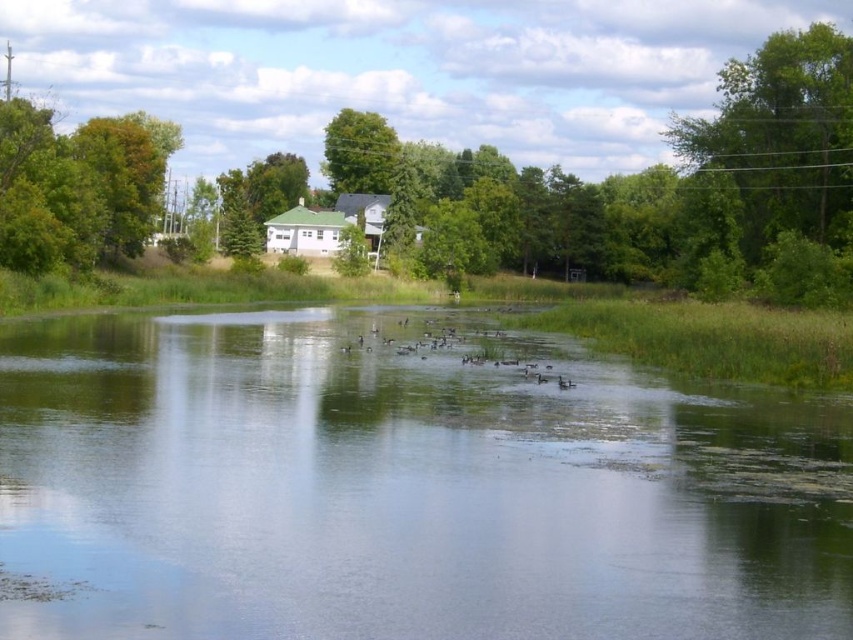
Question: Can you confirm if brown matte duck at center is positioned to the left of green leafy tree at center?

Choices:
 (A) no
 (B) yes

Answer: (A)

Question: Which point is closer to the camera?

Choices:
 (A) green leafy tree at center
 (B) green grassy water at center
 (C) brown matte duck at center
 (D) green leafy tree at upper left

Answer: (B)

Question: Does green grassy water at center have a greater width compared to green leafy tree at upper left?

Choices:
 (A) no
 (B) yes

Answer: (B)

Question: Estimate the real-world distances between objects in this image. Which object is farther from the green grassy water at center?

Choices:
 (A) green leafy tree at center
 (B) brown matte duck at center

Answer: (A)

Question: Among these points, which one is nearest to the camera?

Choices:
 (A) (397, 161)
 (B) (430, 609)

Answer: (B)

Question: Does green leafy tree at upper left appear on the right side of green leafy tree at center?

Choices:
 (A) yes
 (B) no

Answer: (B)